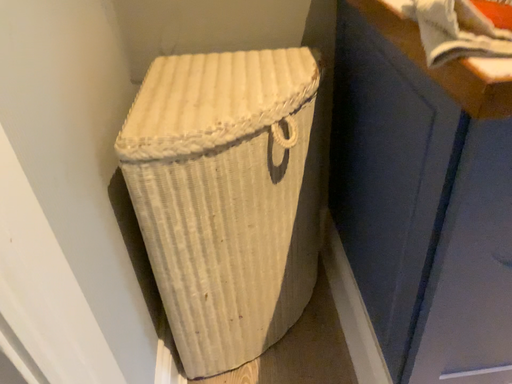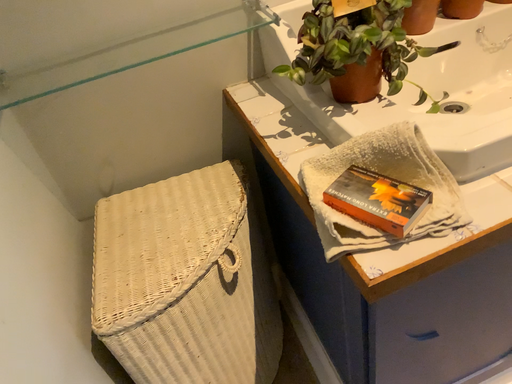
Question: Which way did the camera rotate in the video?

Choices:
 (A) rotated left
 (B) rotated right

Answer: (B)